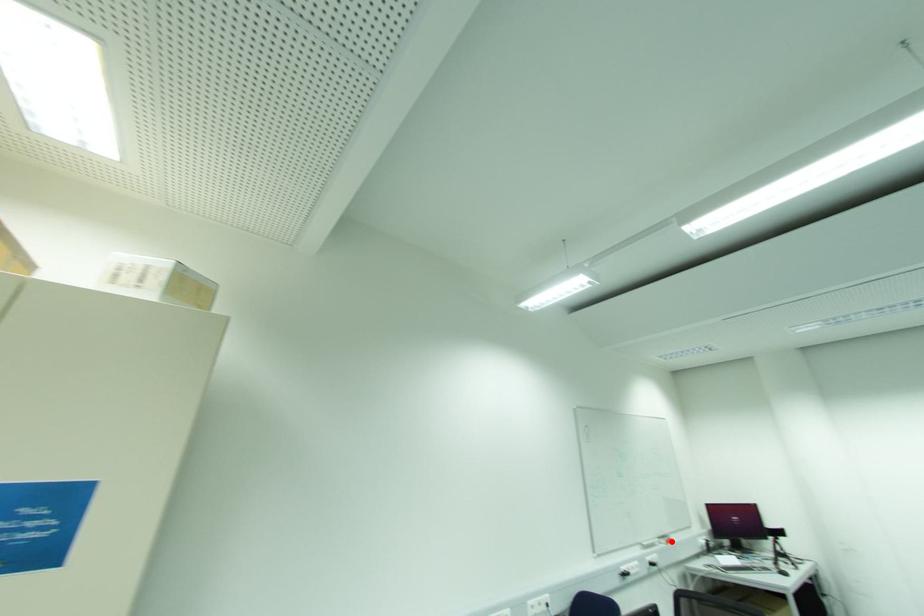
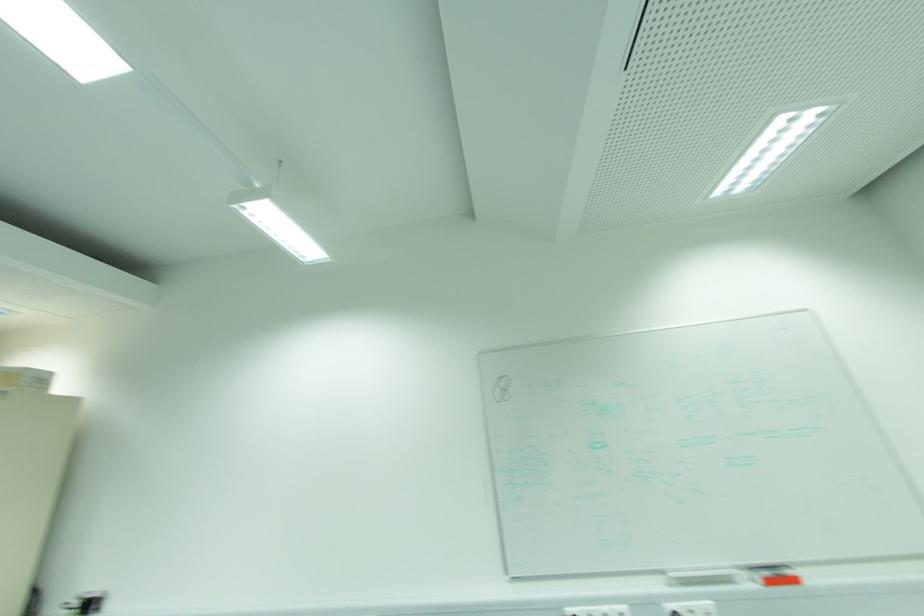
Where in the second image is the point corresponding to the highlighted location from the first image?

(796, 581)